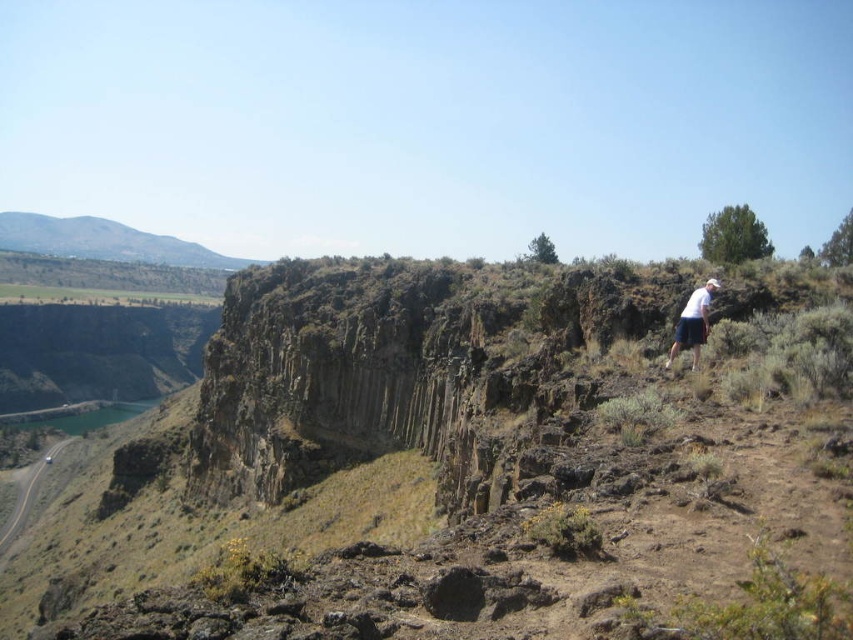
Does green grassy hill at upper left have a greater width compared to white cotton shirt at upper right?

Yes.

Is green grassy hill at upper left above white cotton shirt at upper right?

Correct, green grassy hill at upper left is located above white cotton shirt at upper right.

This screenshot has width=853, height=640. I want to click on green grassy hill at upper left, so click(x=105, y=241).

Can you confirm if smooth asphalt road at lower left is positioned to the right of white cotton shirt at upper right?

In fact, smooth asphalt road at lower left is to the left of white cotton shirt at upper right.

This screenshot has width=853, height=640. Identify the location of smooth asphalt road at lower left. (28, 492).

Image resolution: width=853 pixels, height=640 pixels. Find the location of `smooth asphalt road at lower left`. smooth asphalt road at lower left is located at coordinates (28, 492).

Who is more distant from viewer, (193,248) or (1,545)?

→ Point (193,248)

Can you confirm if green grassy hill at upper left is shorter than smooth asphalt road at lower left?

Incorrect, green grassy hill at upper left's height does not fall short of smooth asphalt road at lower left's.

This screenshot has height=640, width=853. I want to click on green grassy hill at upper left, so click(x=105, y=241).

Identify the location of green grassy hill at upper left. This screenshot has width=853, height=640. (105, 241).